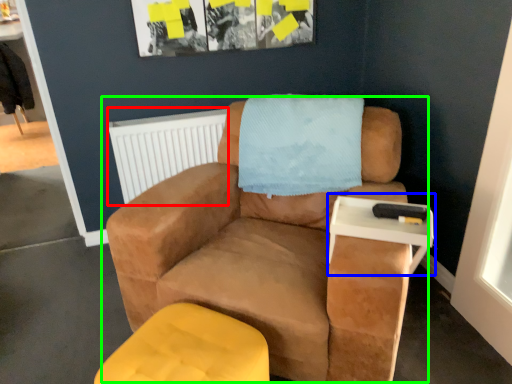
Question: Which is farther away from radiator (highlighted by a red box)? table (highlighted by a blue box) or chair (highlighted by a green box)?

Choices:
 (A) table
 (B) chair

Answer: (A)